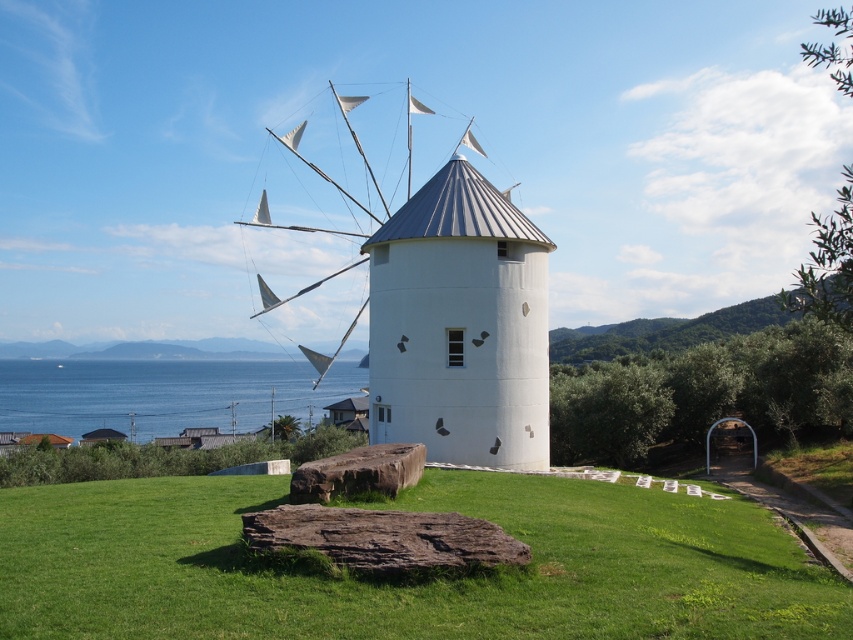
Based on the scene description, what are the coordinates of the white matte windmill at center?

The white matte windmill at center is located at coordinates point (459, 324).

You are standing at the base of the white matte windmill at center. Looking towards the direction of the windmill, where would you see the point marked at coordinate point (459,324)?

The point marked at coordinate point (459,324) marks the white matte windmill at center, so you would see it directly in front of you at the base of the white matte windmill at center.